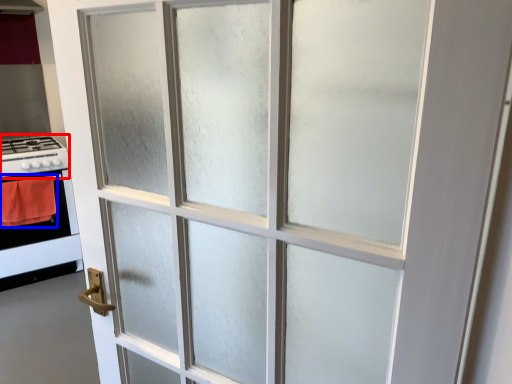
Question: Among these objects, which one is nearest to the camera, gas stove (highlighted by a red box) or blanket (highlighted by a blue box)?

Choices:
 (A) gas stove
 (B) blanket

Answer: (B)